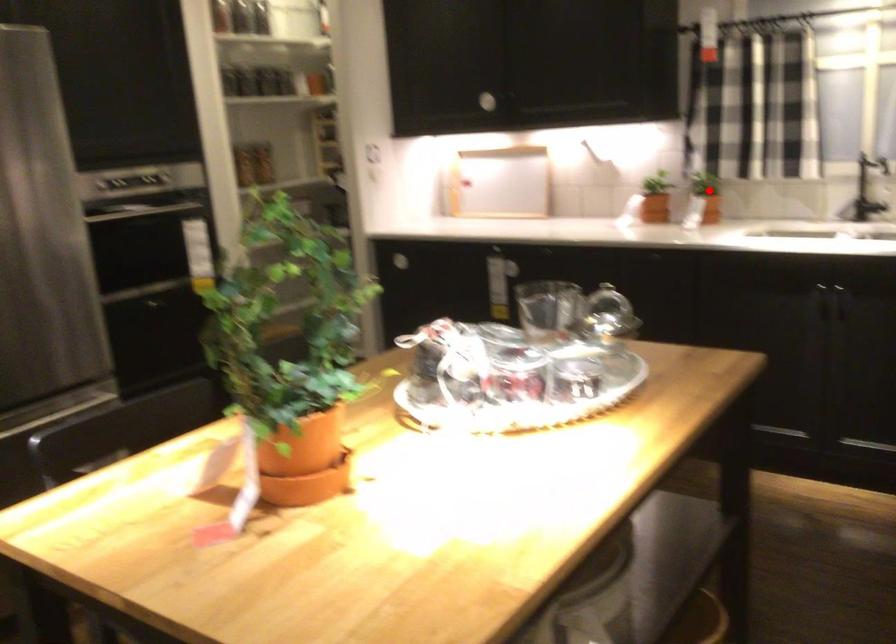
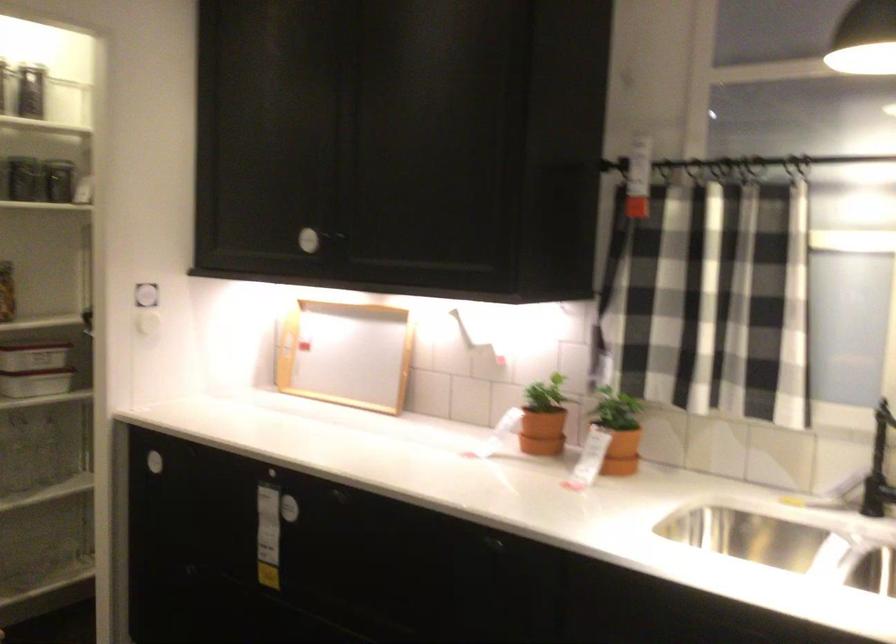
Where in the second image is the point corresponding to the highlighted location from the first image?

(617, 430)